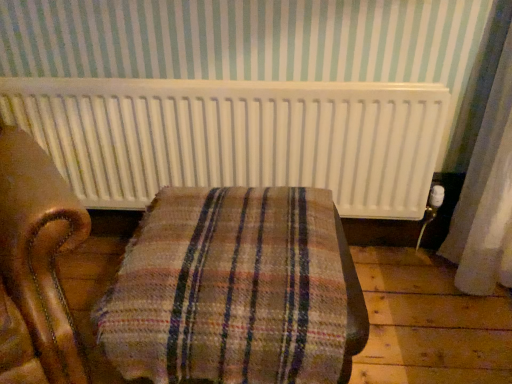
Question: From a real-world perspective, is white matte radiator at upper center under plaid fabric ottoman at center?

Choices:
 (A) no
 (B) yes

Answer: (A)

Question: Does white matte radiator at upper center have a greater width compared to plaid fabric ottoman at center?

Choices:
 (A) yes
 (B) no

Answer: (B)

Question: From the image's perspective, is white matte radiator at upper center located beneath plaid fabric ottoman at center?

Choices:
 (A) yes
 (B) no

Answer: (B)

Question: Does white matte radiator at upper center have a greater height compared to plaid fabric ottoman at center?

Choices:
 (A) yes
 (B) no

Answer: (B)

Question: Is white matte radiator at upper center positioned before plaid fabric ottoman at center?

Choices:
 (A) yes
 (B) no

Answer: (B)

Question: Is white matte radiator at upper center not near plaid fabric ottoman at center?

Choices:
 (A) no
 (B) yes

Answer: (A)

Question: Is plaid fabric ottoman at center positioned with its back to white matte radiator at upper center?

Choices:
 (A) yes
 (B) no

Answer: (A)

Question: Does plaid fabric ottoman at center appear on the left side of white matte radiator at upper center?

Choices:
 (A) yes
 (B) no

Answer: (B)

Question: Is plaid fabric ottoman at center positioned beyond the bounds of white matte radiator at upper center?

Choices:
 (A) no
 (B) yes

Answer: (B)

Question: Can you confirm if plaid fabric ottoman at center is wider than white matte radiator at upper center?

Choices:
 (A) yes
 (B) no

Answer: (A)

Question: Is plaid fabric ottoman at center to the right of white matte radiator at upper center from the viewer's perspective?

Choices:
 (A) yes
 (B) no

Answer: (A)

Question: Does plaid fabric ottoman at center have a larger size compared to white matte radiator at upper center?

Choices:
 (A) no
 (B) yes

Answer: (B)

Question: From a real-world perspective, is white matte radiator at upper center positioned above or below plaid fabric ottoman at center?

Choices:
 (A) below
 (B) above

Answer: (B)